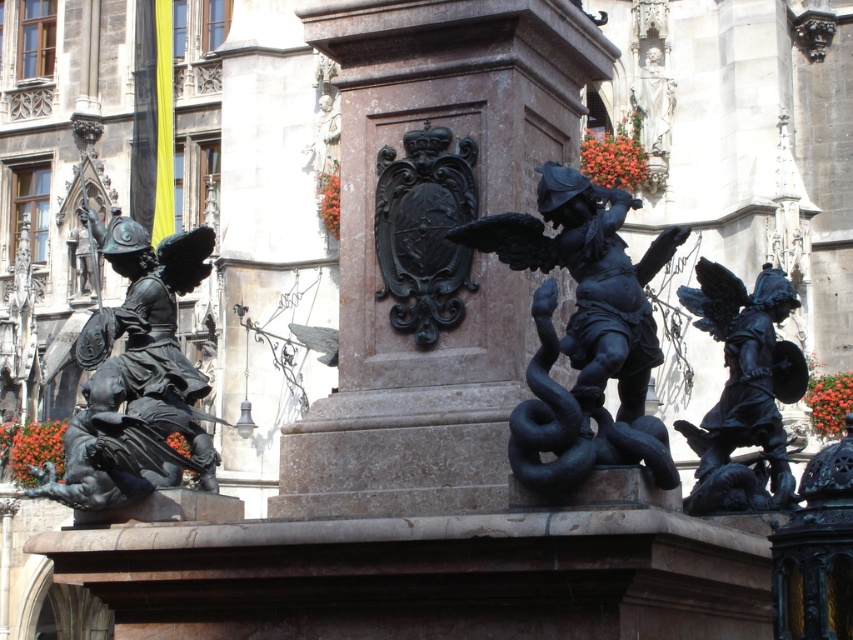
Question: Which of the following is the closest to the observer?

Choices:
 (A) click(x=471, y=337)
 (B) click(x=650, y=461)

Answer: (B)

Question: Estimate the real-world distances between objects in this image. Which object is farther from the black polished shield at center?

Choices:
 (A) black polished statue at center
 (B) polished stone pillar at center
 (C) polished bronze angel at right

Answer: (A)

Question: Is black polished shield at center behind polished bronze figure at center?

Choices:
 (A) no
 (B) yes

Answer: (B)

Question: Is bronze warrior at left thinner than polished bronze figure at center?

Choices:
 (A) yes
 (B) no

Answer: (B)

Question: Is polished bronze angel at right positioned at the back of polished bronze figure at center?

Choices:
 (A) no
 (B) yes

Answer: (B)

Question: Which point is farther to the camera?

Choices:
 (A) (555, 458)
 (B) (572, 156)
 (C) (421, 156)
 (D) (755, 401)

Answer: (B)